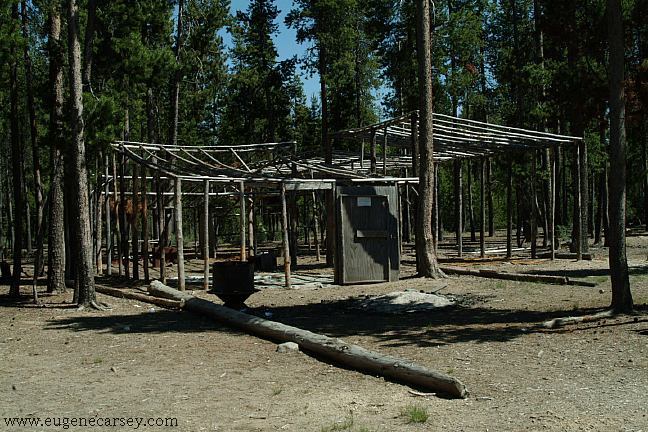
You are a GUI agent. You are given a task and a screenshot of the screen. Output one action in this format:
    pyautogui.click(x=<x>, y=<y>)
    Task: Click on the wooden wall
    The width and height of the screenshot is (648, 432).
    Given the screenshot: What is the action you would take?
    pyautogui.click(x=367, y=220)